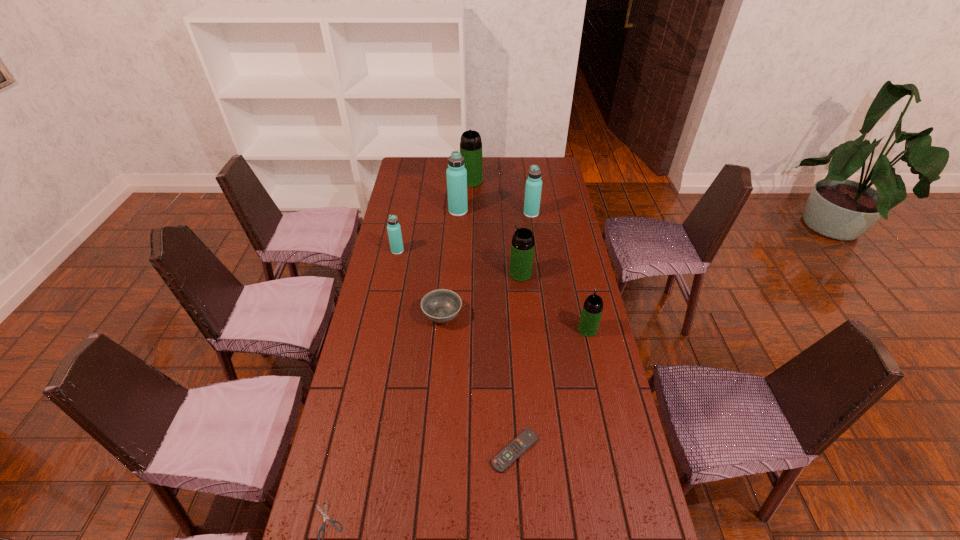
Identify the location of gray bowl. (442, 305).

Locate an element on the screen. the third shortest object is located at coordinates [x=442, y=305].

In order to click on the eighth farthest object in this screenshot , I will do `click(508, 455)`.

The width and height of the screenshot is (960, 540). I want to click on the second shortest object, so point(508,455).

Image resolution: width=960 pixels, height=540 pixels. I want to click on vacant area situated 0.330m from the spout of the farthest object, so pyautogui.click(x=470, y=228).

Image resolution: width=960 pixels, height=540 pixels. In order to click on free region located 0.110m on the back of the biggest aqua thermos bottle in this screenshot , I will do `click(459, 193)`.

Where is `vacant space situated from the spout of the fifth farthest thermos bottle`? vacant space situated from the spout of the fifth farthest thermos bottle is located at coordinates (421, 274).

Locate an element on the screen. free region located from the spout of the fifth farthest thermos bottle is located at coordinates (489, 274).

At what (x,y) coordinates should I click in order to perform the action: click on vacant area situated 0.310m from the spout of the fifth farthest thermos bottle. Please return your answer as a coordinate pair (x, y). The height and width of the screenshot is (540, 960). Looking at the image, I should click on (431, 274).

Locate an element on the screen. free space located 0.350m on the back of the second smallest aqua thermos bottle is located at coordinates (525, 171).